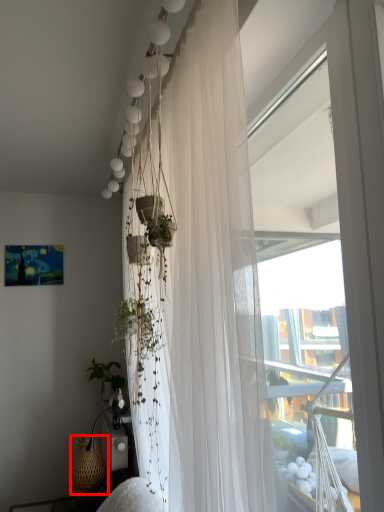
Question: In this image, where is basket (annotated by the red box) located relative to curtain?

Choices:
 (A) left
 (B) right

Answer: (A)